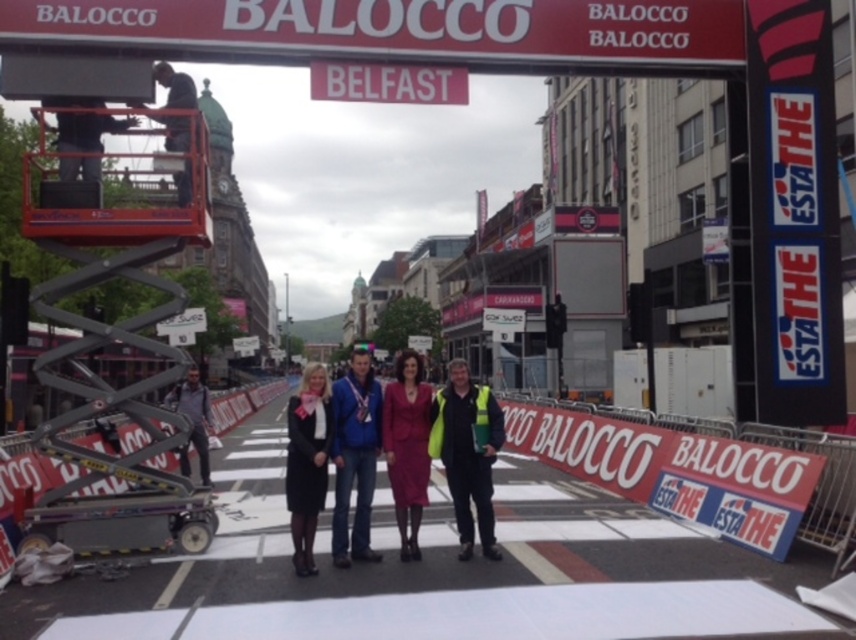
Between blue denim jacket at center and black fabric coat at center, which one appears on the left side from the viewer's perspective?

From the viewer's perspective, black fabric coat at center appears more on the left side.

Can you confirm if blue denim jacket at center is taller than black fabric coat at center?

Incorrect, blue denim jacket at center's height is not larger of black fabric coat at center's.

Locate an element on the screen. Image resolution: width=856 pixels, height=640 pixels. blue denim jacket at center is located at coordinates (355, 454).

Identify the location of blue denim jacket at center. (355, 454).

Who is positioned more to the left, neon yellow safety vest at center or matte pink dress at center?

From the viewer's perspective, matte pink dress at center appears more on the left side.

Can you confirm if neon yellow safety vest at center is wider than matte pink dress at center?

Indeed, neon yellow safety vest at center has a greater width compared to matte pink dress at center.

This screenshot has width=856, height=640. What do you see at coordinates (467, 452) in the screenshot? I see `neon yellow safety vest at center` at bounding box center [467, 452].

Where is `neon yellow safety vest at center`? This screenshot has width=856, height=640. neon yellow safety vest at center is located at coordinates (467, 452).

Which is below, neon yellow safety vest at center or yellow reflective safety vest at center?

neon yellow safety vest at center is below.

Between point (482, 524) and point (441, 436), which one is positioned behind?

Point (441, 436)

I want to click on neon yellow safety vest at center, so click(467, 452).